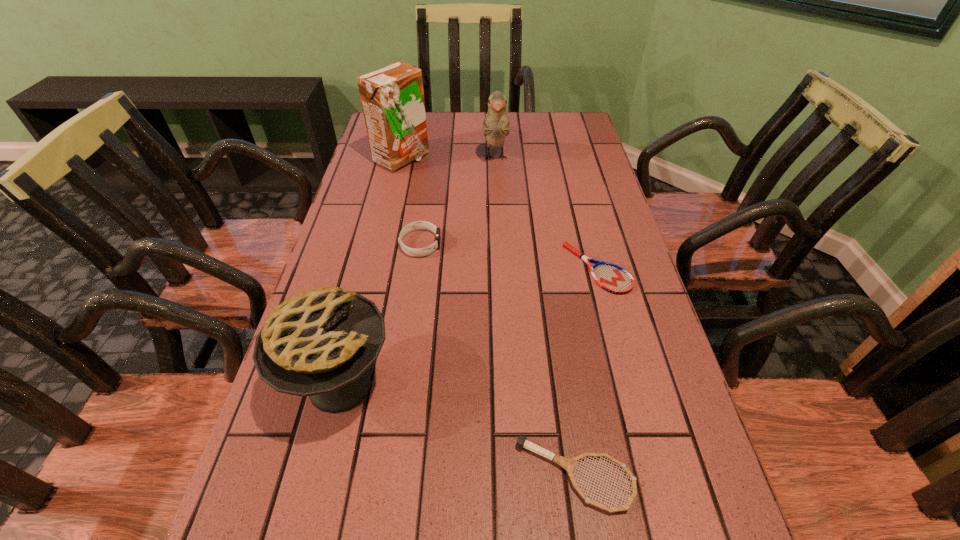
Identify the location of object that is the second closest to the bird. This screenshot has height=540, width=960. (420, 252).

This screenshot has height=540, width=960. I want to click on the second closest tennis racket to the carton, so click(569, 464).

At what (x,y) coordinates should I click in order to perform the action: click on the closest tennis racket to the carton. Please return your answer as a coordinate pair (x, y). Looking at the image, I should click on (612, 278).

Locate an element on the screen. Image resolution: width=960 pixels, height=540 pixels. vacant space that satisfies the following two spatial constraints: 1. on the cut side of the nearer tennis racket; 2. on the left side of the pie is located at coordinates 318,475.

Find the location of a particular element. This screenshot has height=540, width=960. vacant area in the image that satisfies the following two spatial constraints: 1. at the face of the fifth shortest object; 2. on the right side of the second shortest object is located at coordinates (510, 475).

Locate an element on the screen. The image size is (960, 540). free space that satisfies the following two spatial constraints: 1. at the face of the bird; 2. on the left side of the shorter tennis racket is located at coordinates (500, 268).

I want to click on free space that satisfies the following two spatial constraints: 1. on the cut side of the pie; 2. on the left side of the taller tennis racket, so click(318, 475).

Find the location of `vacant space that satisfies the following two spatial constraints: 1. at the face of the bird; 2. on the outer surface of the wristband`. vacant space that satisfies the following two spatial constraints: 1. at the face of the bird; 2. on the outer surface of the wristband is located at coordinates (499, 244).